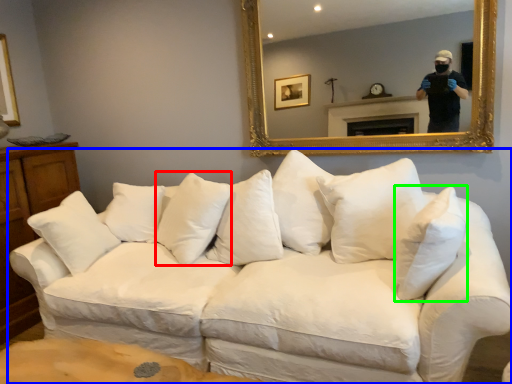
Question: Based on their relative distances, which object is nearer to pillow (highlighted by a red box)? Choose from studio couch (highlighted by a blue box) and pillow (highlighted by a green box).

Choices:
 (A) studio couch
 (B) pillow

Answer: (A)